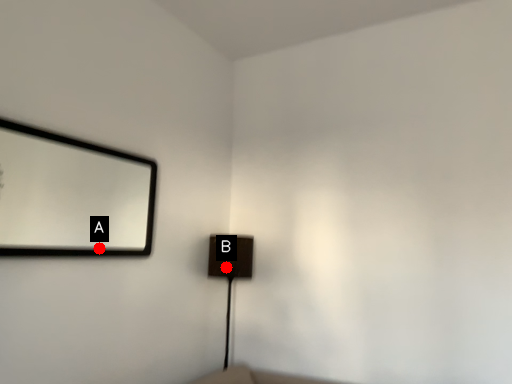
Question: Two points are circled on the image, labeled by A and B beside each circle. Which point appears closest to the camera in this image?

Choices:
 (A) A is closer
 (B) B is closer

Answer: (A)